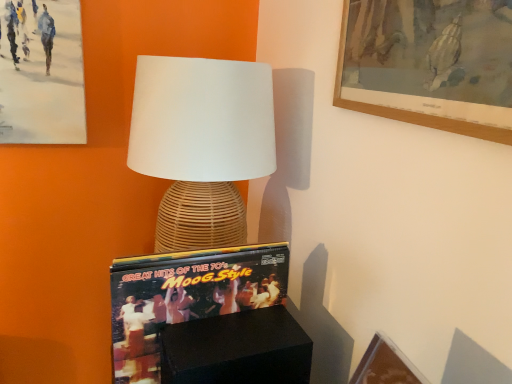
Question: Based on their positions, is woven rattan lamp at center located to the left or right of black matte box at lower center?

Choices:
 (A) right
 (B) left

Answer: (B)

Question: Based on their sizes in the image, would you say woven rattan lamp at center is bigger or smaller than black matte box at lower center?

Choices:
 (A) small
 (B) big

Answer: (B)

Question: Considering the real-world distances, which object is closest to the black matte box at lower center?

Choices:
 (A) woven rattan lamp at center
 (B) matte vinyl record at center

Answer: (B)

Question: Which is farther from the woven rattan lamp at center?

Choices:
 (A) black matte box at lower center
 (B) matte vinyl record at center

Answer: (A)